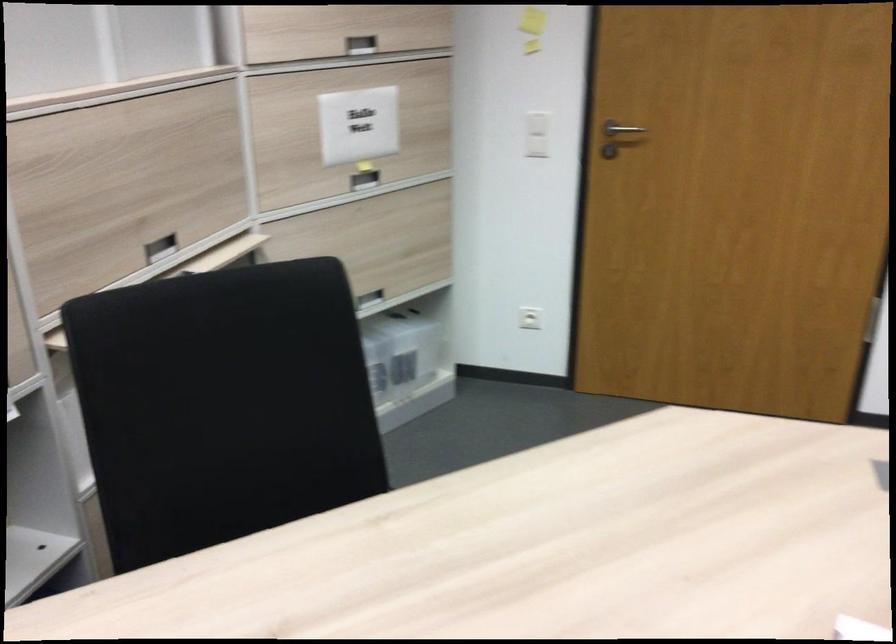
Where would you lift the plastic storage box? Please return your answer as a coordinate pair (x, y).

(401, 353)